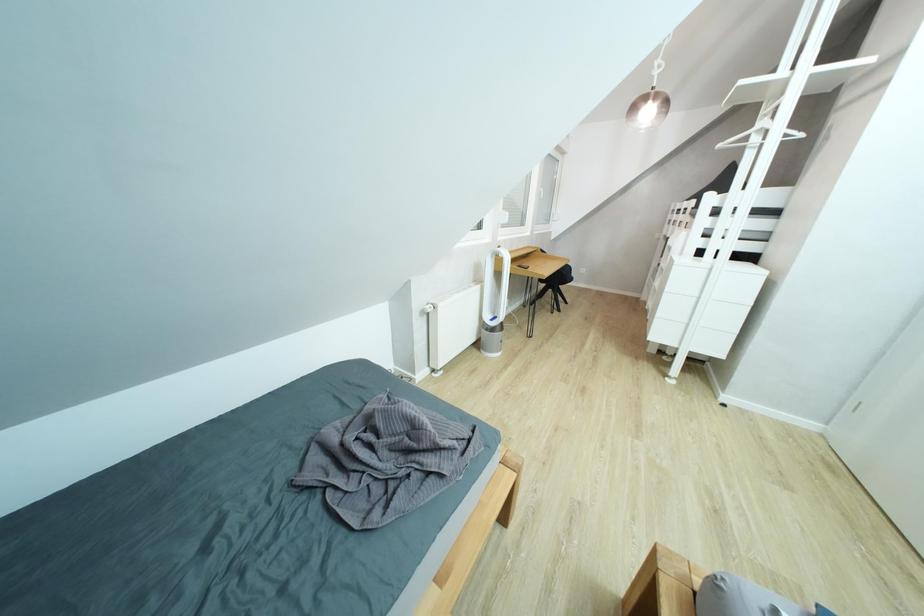
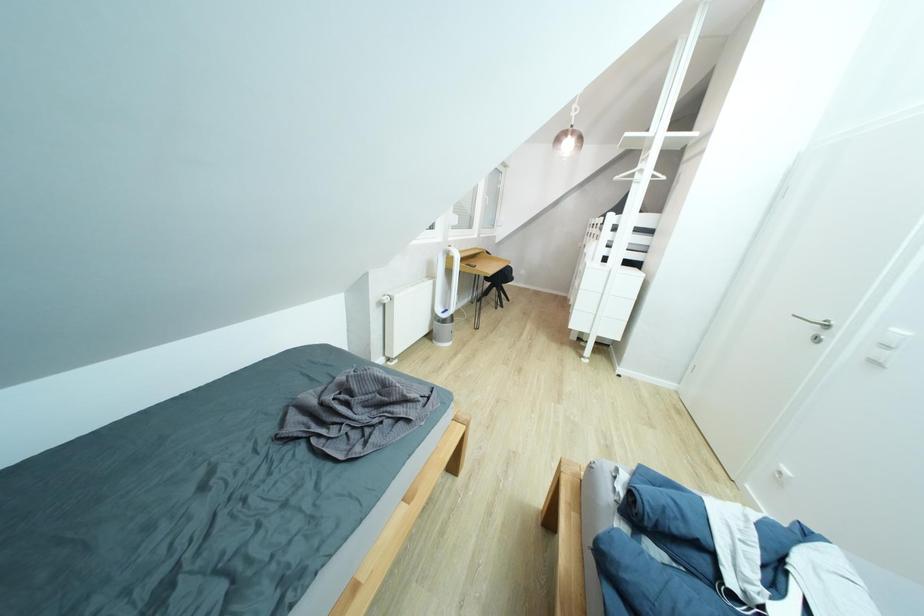
Question: How did the camera likely rotate?

Choices:
 (A) Left
 (B) Right
 (C) Up
 (D) Down

Answer: (B)